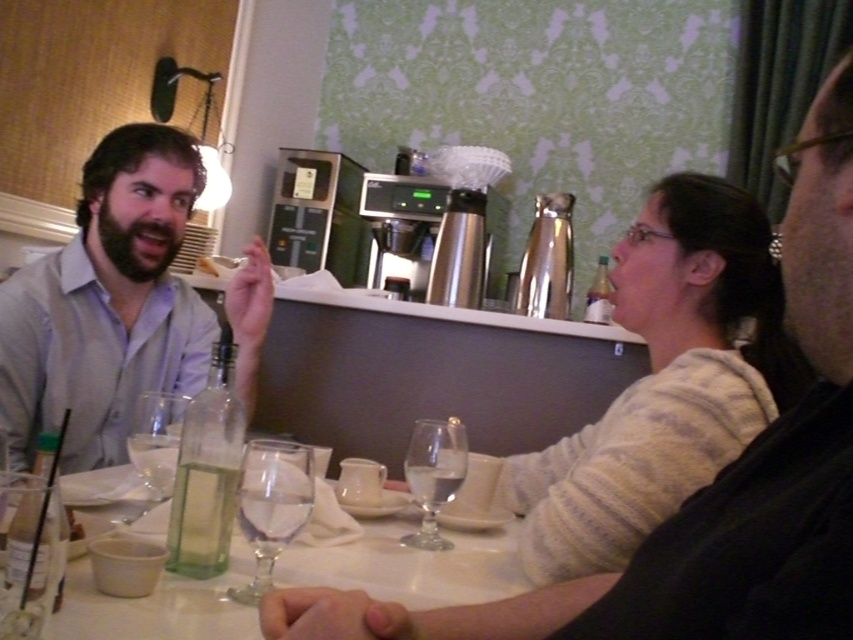
You are sitting at the table in the image and want to place your phone on the light gray sweater at center. Is there enough space for your phone?

The light gray sweater at center is located at point coordinates (666,381), so there is enough space to place your phone there.

You are a server in a restaurant. You need to place a dessert plate between the matte white shirt at left and the clear glass wine glass at table center. The dessert plate has a diameter of 9 inches. Is there enough space between them to fit the plate?

The distance between the matte white shirt at left and the clear glass wine glass at table center is 23.06 inches. Since the dessert plate has a diameter of 9 inches, there is sufficient space to place it between them.

You are a waiter in a restaurant and need to serve two drinks to customers. The clear glass water at center and the transparent glass wine glass at lower center are on the table. Which glass should you use if you need to pour more liquid into it?

The clear glass water at center is bigger than the transparent glass wine glass at lower center, so you should use the clear glass water at center to pour more liquid into it because it has a larger capacity.